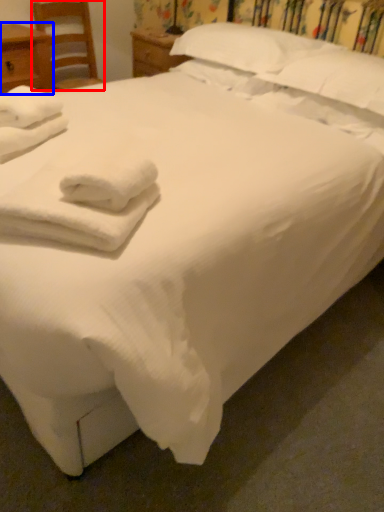
Question: Which object is further to the camera taking this photo, chair (highlighted by a red box) or nightstand (highlighted by a blue box)?

Choices:
 (A) chair
 (B) nightstand

Answer: (A)